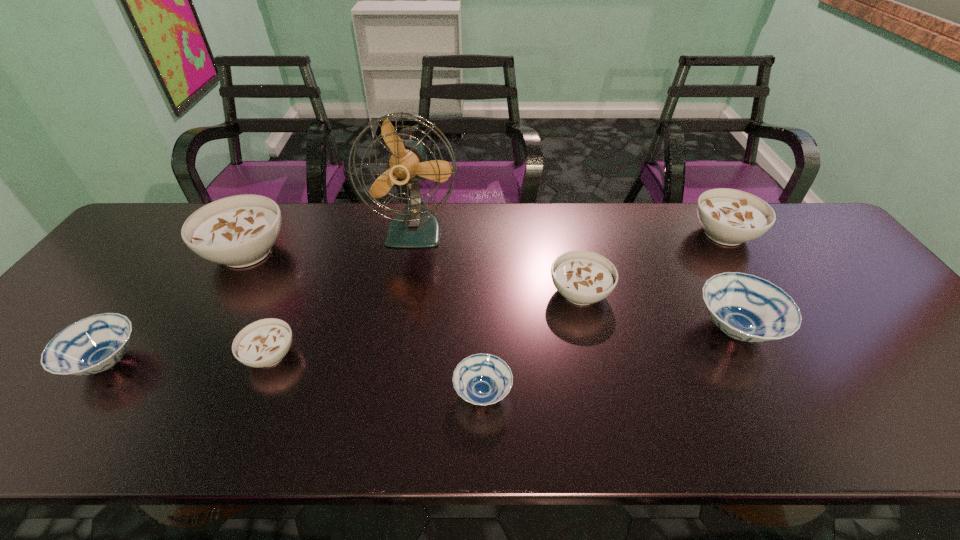
At what (x,y) coordinates should I click in order to perform the action: click on the third white soup bowl from right to left. Please return your answer as a coordinate pair (x, y). Looking at the image, I should click on (263, 343).

Find the location of a particular element. the second blue soup bowl from left to right is located at coordinates (482, 379).

Locate an element on the screen. This screenshot has height=540, width=960. the fourth object from right to left is located at coordinates (482, 379).

You are a GUI agent. You are given a task and a screenshot of the screen. Output one action in this format:
    pyautogui.click(x=<x>, y=<y>)
    Task: Click on the vacant area situated on the front-facing side of the fourth object from left to right for air flow
    The height and width of the screenshot is (540, 960).
    Given the screenshot: What is the action you would take?
    pyautogui.click(x=408, y=275)

This screenshot has height=540, width=960. Identify the location of vacant space situated 0.090m on the right of the biggest white soup bowl. (321, 252).

The height and width of the screenshot is (540, 960). I want to click on vacant space situated 0.180m on the front of the second biggest white soup bowl, so click(x=767, y=303).

Where is `vacant space located 0.370m on the left of the rightmost blue soup bowl`? Image resolution: width=960 pixels, height=540 pixels. vacant space located 0.370m on the left of the rightmost blue soup bowl is located at coordinates (541, 329).

Locate an element on the screen. free space located 0.290m on the front of the second white soup bowl from right to left is located at coordinates click(x=610, y=425).

The width and height of the screenshot is (960, 540). I want to click on free space located 0.080m on the left of the second biggest blue soup bowl, so click(x=36, y=362).

At what (x,y) coordinates should I click in order to perform the action: click on blank space located on the right of the smallest white soup bowl. Please return your answer as a coordinate pair (x, y). This screenshot has width=960, height=540. Looking at the image, I should click on (319, 355).